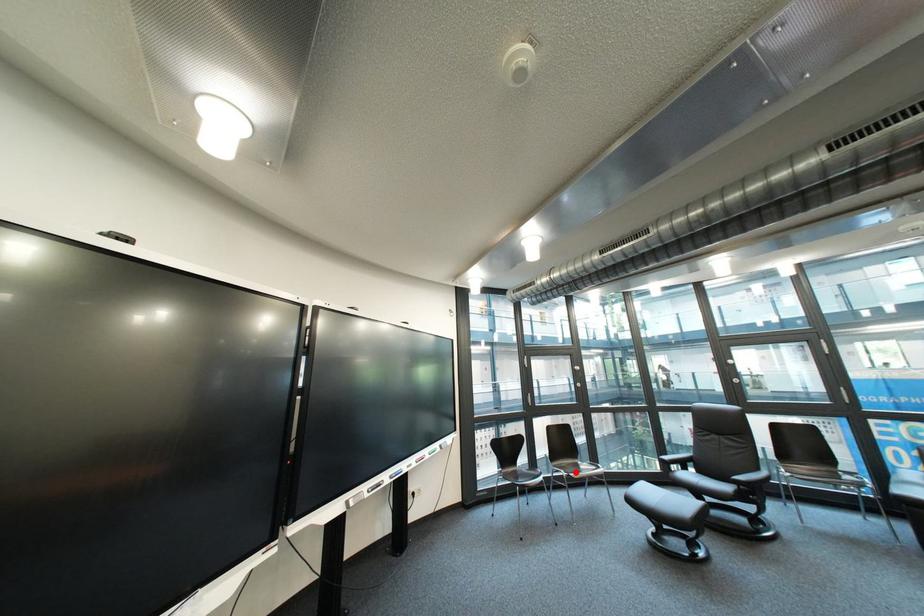
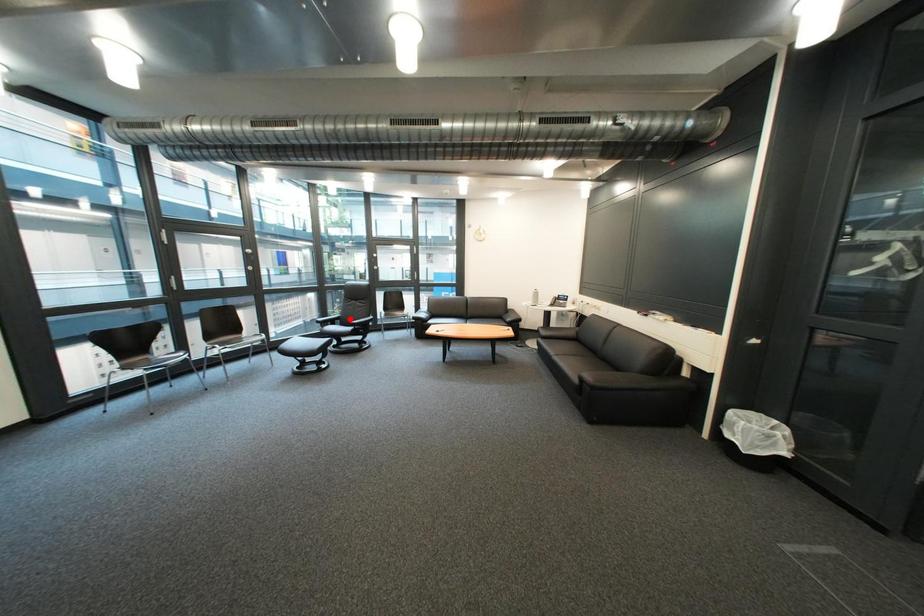
Looking at this image, I am providing you with two images of the same scene from different viewpoints. A red point is marked on the first image and another point is marked on the second image. Is the marked point in image1 the same physical position as the marked point in image2?

No